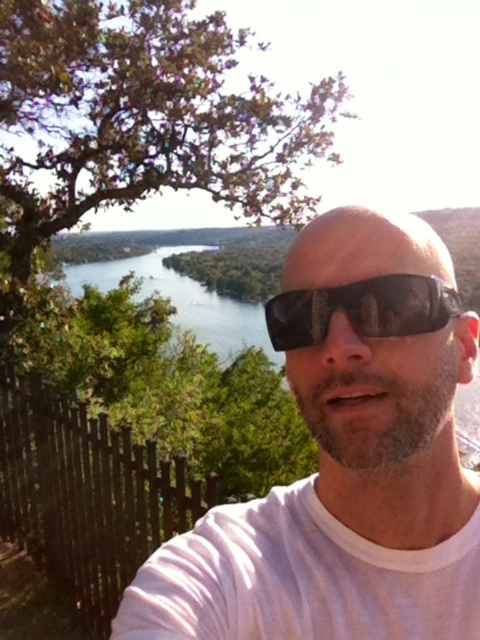
You are a photographer trying to capture the perfect shot of the two sunglasses on a table. The white matte sunglasses at center and the black reflective sunglasses at center are both on the table. Which one is positioned to the left?

The white matte sunglasses at center are positioned to the left of the black reflective sunglasses at center.

You are a photographer trying to capture the perfect shot of the person in the scene. The subject has two pairs of sunglasses on their face, a white matte sunglasses at center and a black reflective sunglasses at center. Which pair of sunglasses is positioned higher on the person?

The white matte sunglasses at center is much taller than the black reflective sunglasses at center, so the white matte sunglasses at center is positioned higher on the person.

You are standing in the scene and want to move from the point at coordinates point [314,516] to the point at coordinates point [311,330]. Which direction should you face to walk towards the second point?

You should face towards the left because point [314,516] is further to the viewer than point [311,330], so moving towards the left will take you closer to the second point.